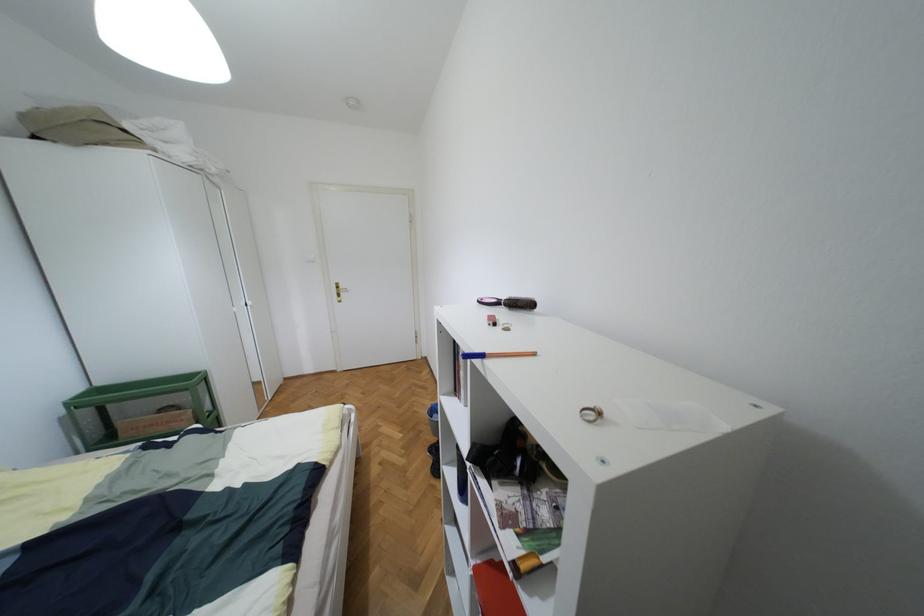
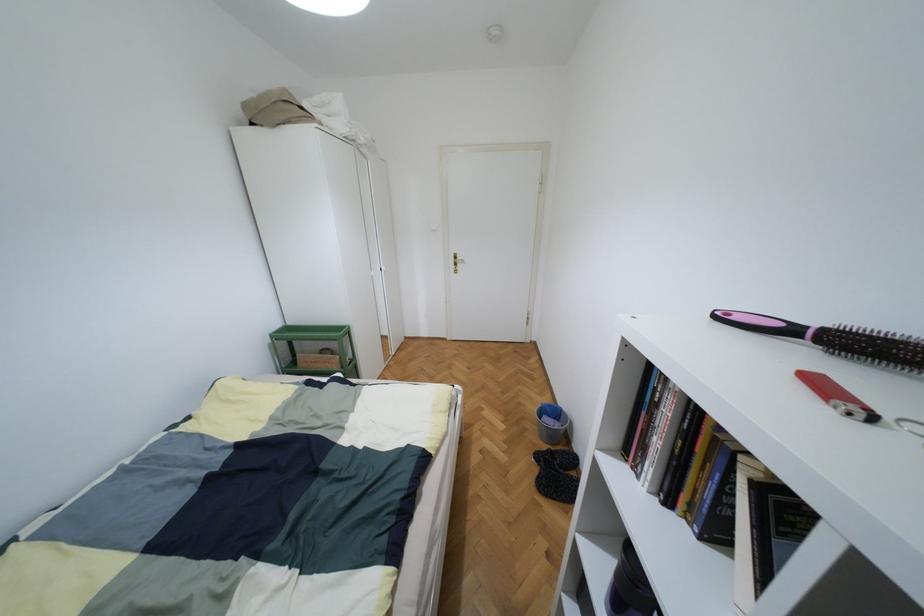
In the second image, find the point that corresponds to point (477, 301) in the first image.

(713, 315)